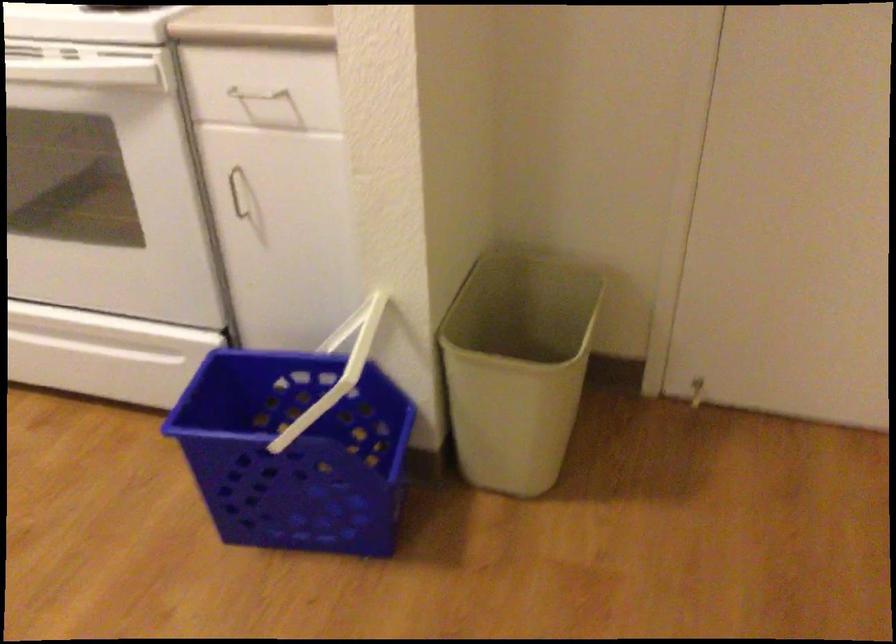
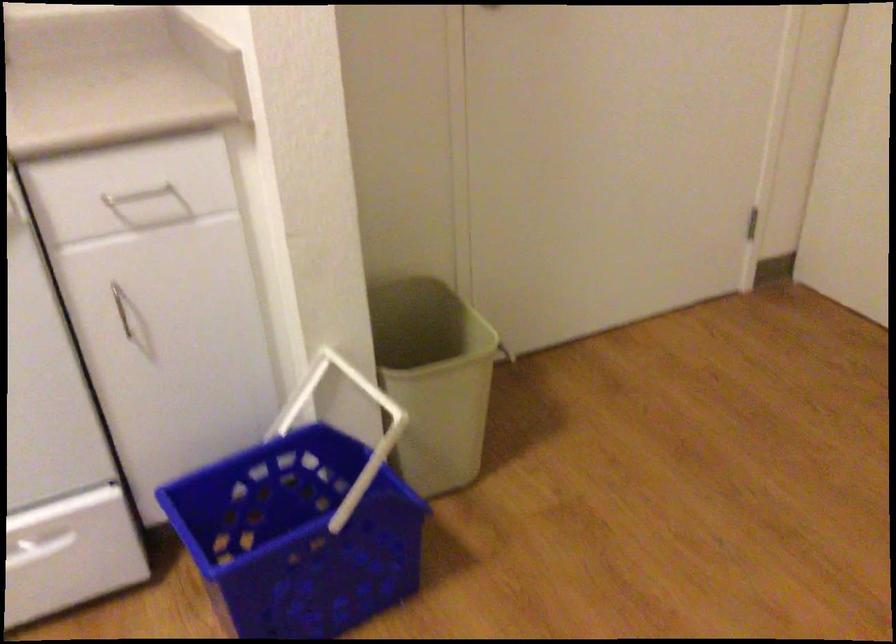
Find the pixel in the second image that matches point (481, 371) in the first image.

(434, 379)